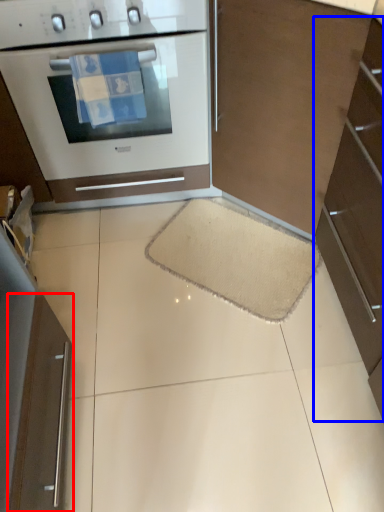
Question: Among these objects, which one is farthest to the camera, appliance (highlighted by a red box) or cabinetry (highlighted by a blue box)?

Choices:
 (A) appliance
 (B) cabinetry

Answer: (A)